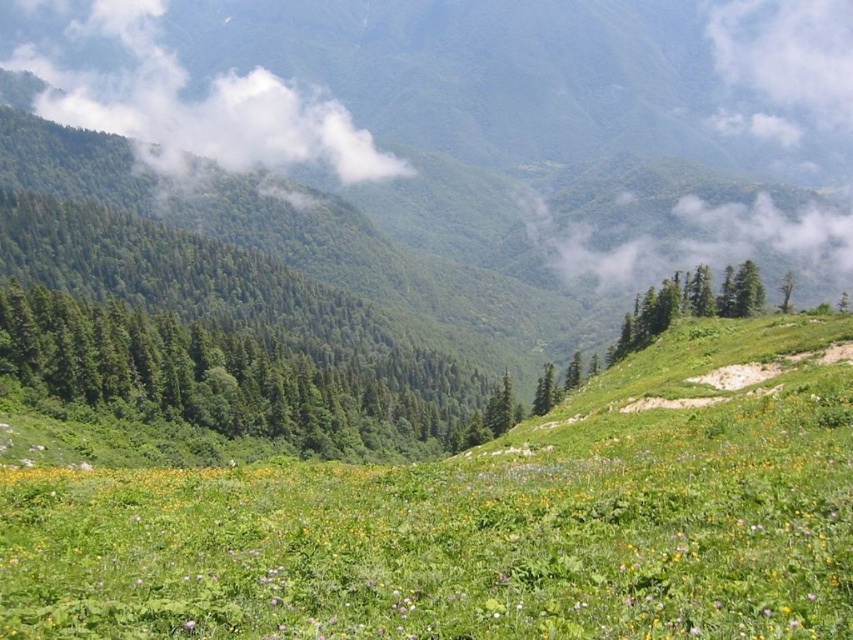
Does point (331, 154) come farther from viewer compared to point (788, 269)?

Yes, point (331, 154) is behind point (788, 269).

Between point (160, 45) and point (791, 291), which one is positioned in front?

Point (791, 291) is in front.

Where is `white fluffy cloud at upper left`? This screenshot has height=640, width=853. white fluffy cloud at upper left is located at coordinates (199, 104).